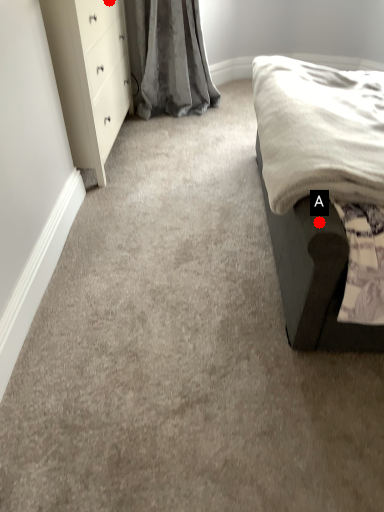
Question: Two points are circled on the image, labeled by A and B beside each circle. Which point appears farthest from the camera in this image?

Choices:
 (A) A is further
 (B) B is further

Answer: (B)